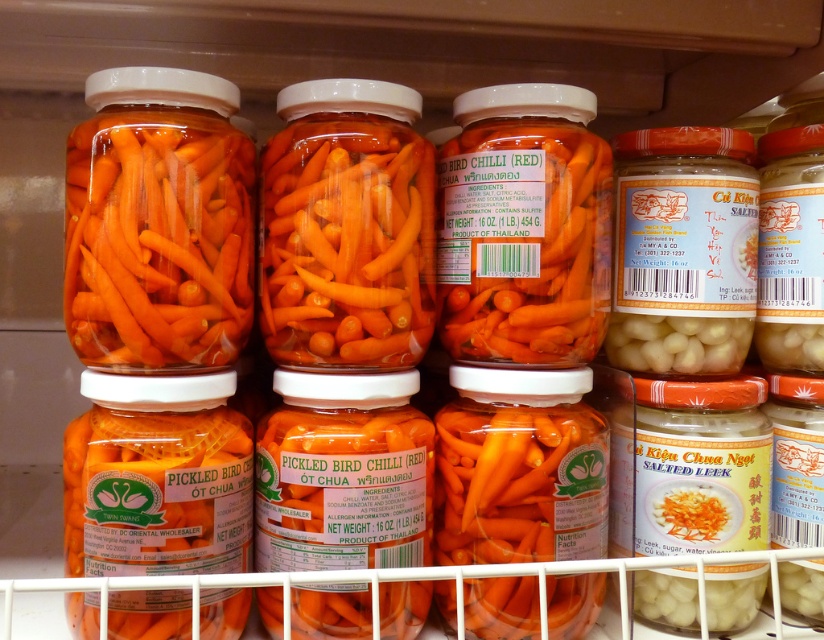
You are organizing the jars on the refrigerator shelf and need to stack them vertically. Which jar, the orange glossy pickled bird chilli at center or the bright orange pickled carrots at center, should you place at the bottom to ensure stability?

The bright orange pickled carrots at center should be placed at the bottom because it has a greater height than the orange glossy pickled bird chilli at center, providing a more stable base for stacking.

You are organizing the refrigerator shelf and want to place a new jar of pickled carrots between the orange glossy pickled carrots at center and the translucent glass jar of pickled bird chilli at center. Is there enough vertical space between them to fit the new jar?

The orange glossy pickled carrots at center is located above the translucent glass jar of pickled bird chilli at center, so there is vertical space between them. However, the question does not provide information about the height of the new jar or the existing spacing, making it impossible to determine if it will fit.

You are organizing the refrigerator shelf and need to move the translucent glass jar of pickled bird chilli at center to the front. Currently, it is behind the orange glossy pickled carrots at center. After moving it to the front, will it be visible to someone looking straight at the shelf?

Yes, the translucent glass jar of pickled bird chilli at center will be visible after moving it to the front of the orange glossy pickled carrots at center since it will now be in the forward position.